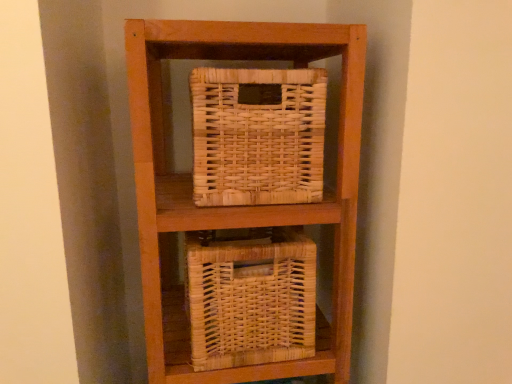
Question: Considering the positions of point (209, 352) and point (206, 200), is point (209, 352) closer or farther from the camera than point (206, 200)?

Choices:
 (A) closer
 (B) farther

Answer: (B)

Question: Would you say natural wicker basket at lower center, positioned as the first basket in bottom-to-top order, is to the left or to the right of natural wicker basket at upper center, the second basket from the bottom, in the picture?

Choices:
 (A) right
 (B) left

Answer: (B)

Question: Is natural wicker basket at lower center, positioned as the first basket in bottom-to-top order, in front of or behind natural wicker basket at upper center, placed as the first basket when sorted from top to bottom, in the image?

Choices:
 (A) front
 (B) behind

Answer: (B)

Question: From a real-world perspective, is natural wicker basket at upper center, the second basket from the bottom, positioned above or below natural wicker basket at lower center, positioned as the first basket in bottom-to-top order?

Choices:
 (A) below
 (B) above

Answer: (B)

Question: Considering the positions of natural wicker basket at upper center, placed as the first basket when sorted from top to bottom, and natural wicker basket at lower center, positioned as the 2th basket in top-to-bottom order, in the image, is natural wicker basket at upper center, placed as the first basket when sorted from top to bottom, bigger or smaller than natural wicker basket at lower center, positioned as the 2th basket in top-to-bottom order,?

Choices:
 (A) big
 (B) small

Answer: (B)

Question: From their relative heights in the image, would you say natural wicker basket at upper center, placed as the first basket when sorted from top to bottom, is taller or shorter than natural wicker basket at lower center, positioned as the 2th basket in top-to-bottom order?

Choices:
 (A) tall
 (B) short

Answer: (B)

Question: In terms of width, does natural wicker basket at upper center, the second basket from the bottom, look wider or thinner when compared to natural wicker basket at lower center, positioned as the first basket in bottom-to-top order?

Choices:
 (A) thin
 (B) wide

Answer: (A)